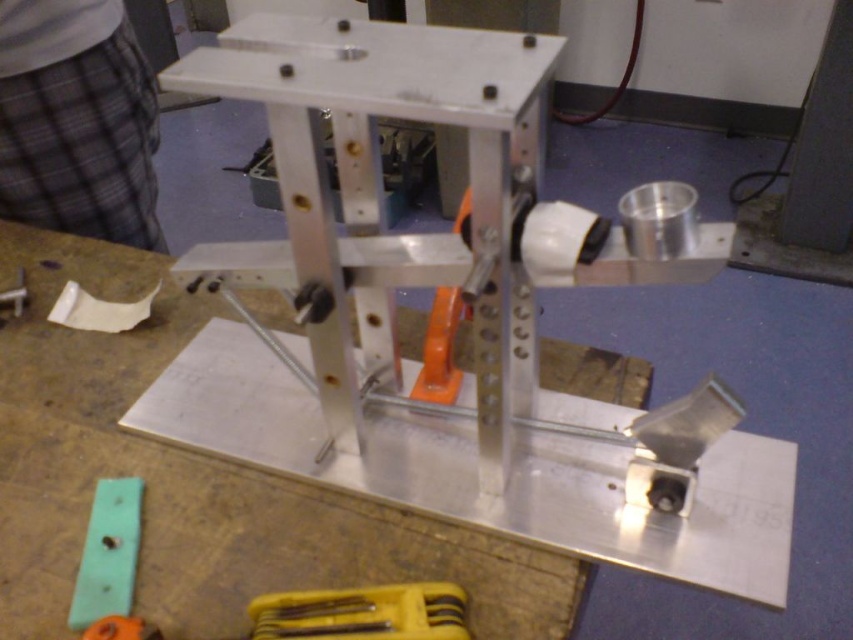
Question: From the image, what is the correct spatial relationship of metallic silver table at center in relation to matte plastic ruler at lower left?

Choices:
 (A) left
 (B) right

Answer: (B)

Question: Can you confirm if yellow plastic tool at lower center is positioned below matte plastic ruler at lower left?

Choices:
 (A) no
 (B) yes

Answer: (B)

Question: Which of the following is the farthest from the observer?

Choices:
 (A) matte plastic ruler at lower left
 (B) yellow plastic tool at lower center
 (C) green plastic ruler at lower left
 (D) metallic silver table at center

Answer: (A)

Question: Which object is positioned closest to the matte plastic ruler at lower left?

Choices:
 (A) metallic silver table at center
 (B) green plastic ruler at lower left

Answer: (A)

Question: Is green plastic ruler at lower left bigger than matte plastic ruler at lower left?

Choices:
 (A) yes
 (B) no

Answer: (A)

Question: Which of the following is the closest to the observer?

Choices:
 (A) matte plastic ruler at lower left
 (B) yellow plastic tool at lower center

Answer: (B)